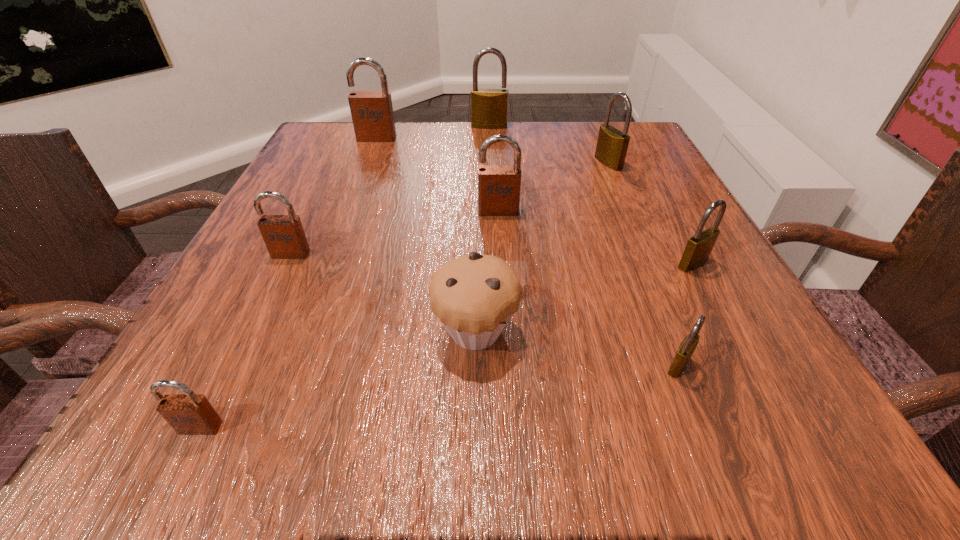
This screenshot has width=960, height=540. In the image, there is a desktop. Identify the location of free space at the left edge. (329, 278).

Locate an element on the screen. The width and height of the screenshot is (960, 540). vacant space at the right edge is located at coordinates coord(658,254).

This screenshot has width=960, height=540. Find the location of `free region at the near left corner of the desktop`. free region at the near left corner of the desktop is located at coordinates (222, 406).

The height and width of the screenshot is (540, 960). I want to click on vacant area at the far right corner, so (x=636, y=138).

Find the location of a particular element. The width and height of the screenshot is (960, 540). vacant space at the near right corner of the desktop is located at coordinates (732, 405).

Locate an element on the screen. The width and height of the screenshot is (960, 540). unoccupied area between the rightmost padlock and the third farthest padlock is located at coordinates (651, 213).

Where is `vacant point located between the biggest brown padlock and the smallest brown padlock`? vacant point located between the biggest brown padlock and the smallest brown padlock is located at coordinates (289, 282).

In order to click on free space between the smallest brown padlock and the farthest object in this screenshot , I will do `click(345, 276)`.

In order to click on vacant space that is in between the smallest brown padlock and the muffin in this screenshot , I will do `click(338, 379)`.

Image resolution: width=960 pixels, height=540 pixels. I want to click on blank region between the muffin and the third smallest brass padlock, so click(x=542, y=247).